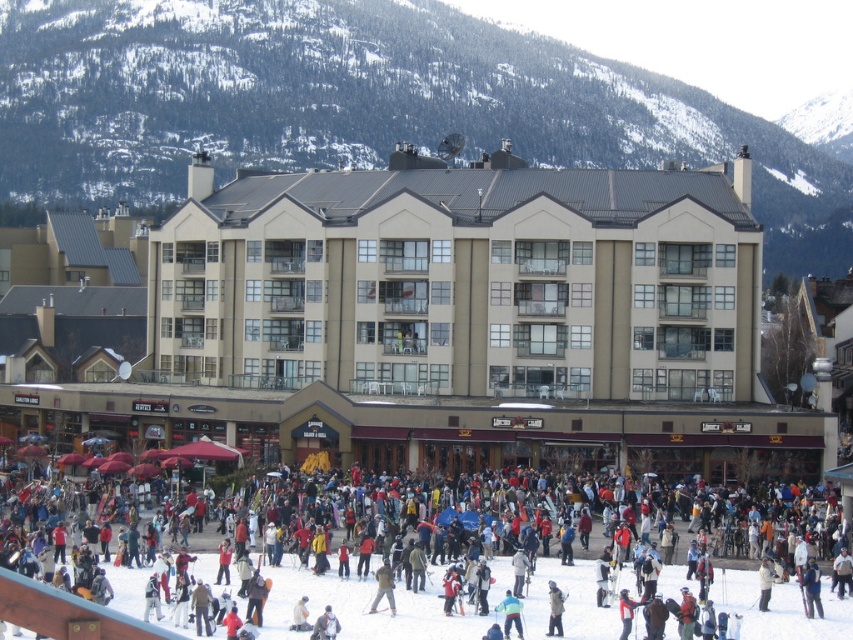
Question: Can you confirm if beige concrete building at center is bigger than khaki fabric jacket at center?

Choices:
 (A) no
 (B) yes

Answer: (B)

Question: Which point is farther from the camera taking this photo?

Choices:
 (A) (299, 586)
 (B) (508, 602)
 (C) (335, 616)

Answer: (A)

Question: Among these points, which one is farthest from the camera?

Choices:
 (A) (317, 627)
 (B) (376, 461)

Answer: (B)

Question: Is snowy gray mountain at upper center further to the viewer compared to matte black jacket at center?

Choices:
 (A) no
 (B) yes

Answer: (B)

Question: Is the position of matte black jacket at center less distant than that of khaki fabric jacket at center?

Choices:
 (A) no
 (B) yes

Answer: (B)

Question: Among these points, which one is farthest from the camera?

Choices:
 (A) (334, 630)
 (B) (503, 614)
 (C) (555, 630)
 (D) (625, 560)

Answer: (D)